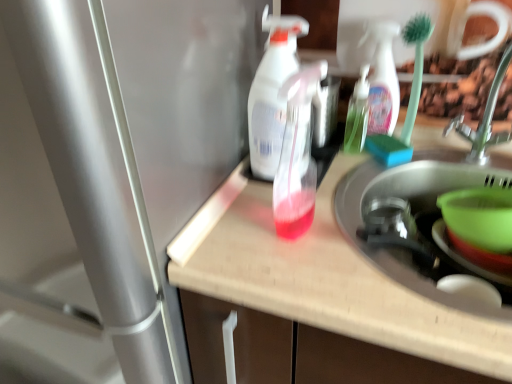
Identify the location of metallic silver faucet at upper right. This screenshot has width=512, height=384. (484, 120).

What do you see at coordinates (484, 120) in the screenshot? The image size is (512, 384). I see `metallic silver faucet at upper right` at bounding box center [484, 120].

Measure the distance between translucent plastic spray bottle at center and camera.

translucent plastic spray bottle at center is 28.64 inches away from camera.

What do you see at coordinates (322, 278) in the screenshot? I see `translucent plastic bottle at center` at bounding box center [322, 278].

This screenshot has width=512, height=384. I want to click on green plastic brush at upper right, so click(x=415, y=68).

Locate an element on the screen. green plastic bowl at sink right is located at coordinates (480, 217).

The height and width of the screenshot is (384, 512). What do you see at coordinates (480, 217) in the screenshot? I see `green plastic bowl at sink right` at bounding box center [480, 217].

Identify the location of metallic silver faucet at upper right. The image size is (512, 384). (484, 120).

Considering the sizes of objects green plastic bowl at sink right and translucent plastic bottle at center, the second bottle viewed from the front, in the image provided, who is bigger, green plastic bowl at sink right or translucent plastic bottle at center, the second bottle viewed from the front,?

green plastic bowl at sink right.

Is green plastic bowl at sink right wider or thinner than translucent plastic bottle at center, the second bottle viewed from the front?

green plastic bowl at sink right is wider than translucent plastic bottle at center, the second bottle viewed from the front.

What are the coordinates of `the 1st bottle positioned above the green plastic bowl at sink right (from a real-world perspective)` in the screenshot? It's located at 357,114.

Is green plastic bowl at sink right closer to camera compared to translucent plastic bottle at center, which is the 1th bottle from back to front?

Yes.

From the image's perspective, would you say brushed metal water heater at left is positioned over green plastic bowl at sink right?

No, from the image's perspective, brushed metal water heater at left is not over green plastic bowl at sink right.

Based on the photo, relative to green plastic bowl at sink right, is brushed metal water heater at left in front or behind?

In the image, brushed metal water heater at left appears in front of green plastic bowl at sink right.

Is the surface of brushed metal water heater at left in direct contact with green plastic bowl at sink right?

brushed metal water heater at left is not next to green plastic bowl at sink right, and they're not touching.

Based on the photo, from a real-world perspective, who is located higher, brushed metal water heater at left or green plastic bowl at sink right?

green plastic bowl at sink right is physically above.

Locate an element on the screen. faucet on the right of green plastic brush at upper right is located at coordinates (484, 120).

From a real-world perspective, is metallic silver faucet at upper right physically below green plastic brush at upper right?

Yes, from a real-world perspective, metallic silver faucet at upper right is below green plastic brush at upper right.

Considering the sizes of objects metallic silver faucet at upper right and green plastic brush at upper right in the image provided, who is thinner, metallic silver faucet at upper right or green plastic brush at upper right?

green plastic brush at upper right.

From the image's perspective, is metallic silver faucet at upper right located beneath green plastic brush at upper right?

Yes.

Which is in front, green plastic bowl at lower right or translucent plastic bottle at center?

translucent plastic bottle at center is closer to the camera.

Can we say green plastic bowl at lower right lies outside translucent plastic bottle at center?

That's incorrect, green plastic bowl at lower right is not completely outside translucent plastic bottle at center.

From the image's perspective, relative to translucent plastic bottle at center, is green plastic bowl at lower right above or below?

Clearly, from the image's perspective, green plastic bowl at lower right is above translucent plastic bottle at center.

Would you say green plastic bowl at lower right is a long distance from translucent plastic bottle at center?

No, there isn't a large distance between green plastic bowl at lower right and translucent plastic bottle at center.

Is metallic silver faucet at upper right oriented towards green plastic bowl at sink right?

No, metallic silver faucet at upper right is not aimed at green plastic bowl at sink right.

From the image's perspective, which object appears higher, metallic silver faucet at upper right or green plastic bowl at sink right?

metallic silver faucet at upper right.

Between point (504, 60) and point (502, 217), which one is positioned in front?

The point (502, 217) is in front.

This screenshot has width=512, height=384. What are the coordinates of `basin below the metallic silver faucet at upper right (from a real-world perspective)` in the screenshot? It's located at click(480, 217).

From the picture: Which object is wider, metallic silver faucet at upper right or brushed metal water heater at left?

brushed metal water heater at left.

Which is closer to the camera, [496,98] or [70,120]?

Positioned in front is point [70,120].

How distant is metallic silver faucet at upper right from brushed metal water heater at left?

metallic silver faucet at upper right and brushed metal water heater at left are 25.29 inches apart.

Is translucent plastic spray bottle at center placed right next to green plastic bowl at sink right?

No.

Based on their sizes in the image, would you say translucent plastic spray bottle at center is bigger or smaller than green plastic bowl at sink right?

Considering their sizes, translucent plastic spray bottle at center takes up less space than green plastic bowl at sink right.

Considering the positions of points (257, 95) and (459, 237), is point (257, 95) closer to camera compared to point (459, 237)?

Yes, it is in front of point (459, 237).

Looking at this image, which object is closer to the camera, translucent plastic spray bottle at center or green plastic bowl at sink right?

Positioned in front is translucent plastic spray bottle at center.

You are a GUI agent. You are given a task and a screenshot of the screen. Output one action in this format:
    pyautogui.click(x=<x>, y=<y>)
    Task: Click on the bottle lying behind the green plastic bowl at sink right
    Image resolution: width=512 pixels, height=384 pixels.
    Given the screenshot: What is the action you would take?
    pyautogui.click(x=357, y=114)

Find the location of a particular element. This screenshot has height=384, width=512. basin above the brushed metal water heater at left (from a real-world perspective) is located at coordinates (480, 217).

Estimate the real-world distances between objects in this image. Which object is closer to translucent plastic spray bottle at center, translucent plastic bottle at center or metallic silver faucet at upper right?

Among the two, translucent plastic bottle at center is located nearer to translucent plastic spray bottle at center.

Which object lies nearer to the anchor point translucent plastic spray bottle at center, the second bottle in the back-to-front sequence, green plastic bowl at sink right or green plastic brush at upper right?

green plastic bowl at sink right is positioned closer to the anchor translucent plastic spray bottle at center, the second bottle in the back-to-front sequence.

From the picture: From the image, which object appears to be farther from metallic silver faucet at upper right, translucent plastic bottle at center, the second bottle viewed from the front, or green plastic bowl at lower right?

Based on the image, translucent plastic bottle at center, the second bottle viewed from the front, appears to be further to metallic silver faucet at upper right.

Considering their positions, is translucent plastic spray bottle at center positioned closer to translucent plastic bottle at center than translucent plastic spray bottle at center, the second bottle in the back-to-front sequence?

translucent plastic spray bottle at center, the second bottle in the back-to-front sequence, is positioned closer to the anchor translucent plastic bottle at center.

From the image, which object appears to be nearer to translucent plastic spray bottle at center, green plastic brush at upper right or translucent plastic bottle at center?

Among the two, translucent plastic bottle at center is located nearer to translucent plastic spray bottle at center.

Which object lies nearer to the anchor point green plastic brush at upper right, green plastic bowl at sink right or brushed metal water heater at left?

green plastic bowl at sink right.

Considering their positions, is green plastic brush at upper right positioned closer to translucent plastic bottle at center, the 1th bottle viewed from the right, than metallic silver faucet at upper right?

Among the two, green plastic brush at upper right is located nearer to translucent plastic bottle at center, the 1th bottle viewed from the right.

When comparing their distances from green plastic brush at upper right, does translucent plastic bottle at center, which is the 1th bottle from back to front, or translucent plastic spray bottle at center, which appears as the second bottle when viewed from the right, seem further?

Based on the image, translucent plastic spray bottle at center, which appears as the second bottle when viewed from the right, appears to be further to green plastic brush at upper right.

Find the location of a particular element. The image size is (512, 384). sink between translucent plastic spray bottle at center, the second bottle in the back-to-front sequence, and green plastic bowl at sink right from left to right is located at coordinates (418, 217).

The image size is (512, 384). I want to click on sink between green plastic bowl at sink right and translucent plastic bottle at center in the up-down direction, so click(x=418, y=217).

Identify the location of basin that lies between translucent plastic bottle at center, the second bottle viewed from the front, and translucent plastic bottle at center from top to bottom. (480, 217).

Image resolution: width=512 pixels, height=384 pixels. In order to click on bottle between metallic silver faucet at upper right and translucent plastic bottle at center in the up-down direction in this screenshot , I will do `click(297, 156)`.